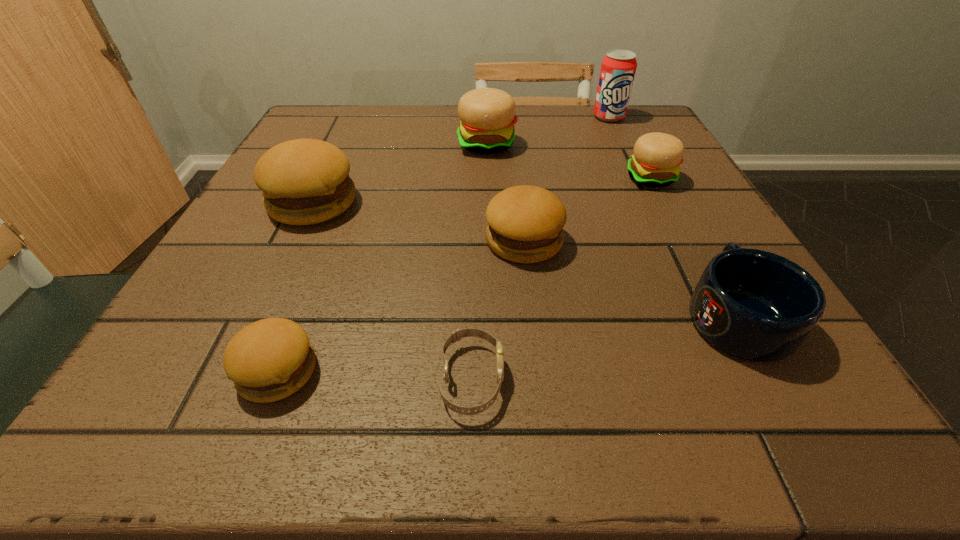
You are a GUI agent. You are given a task and a screenshot of the screen. Output one action in this format:
    pyautogui.click(x=<x>, y=<y>)
    Task: Click on the object that is the seventh closest one to the farthest object
    The height and width of the screenshot is (540, 960).
    Given the screenshot: What is the action you would take?
    pyautogui.click(x=268, y=360)

Identify which object is the sixth nearest to the nearest hamburger. Please provide its 2D coordinates. Your answer should be formatted as a tuple, i.e. [(x, y)], where the tuple contains the x and y coordinates of a point satisfying the conditions above.

[(656, 161)]

This screenshot has width=960, height=540. I want to click on hamburger that can be found as the closest to the watch, so click(x=525, y=223).

Locate which hamburger ranks in proximity to the farthest object. Please provide its 2D coordinates. Your answer should be formatted as a tuple, i.e. [(x, y)], where the tuple contains the x and y coordinates of a point satisfying the conditions above.

[(656, 161)]

Locate which brown hamburger ranks in proximity to the nearer beige hamburger. Please provide its 2D coordinates. Your answer should be formatted as a tuple, i.e. [(x, y)], where the tuple contains the x and y coordinates of a point satisfying the conditions above.

[(525, 223)]

Identify which brown hamburger is located as the second nearest to the left beige hamburger. Please provide its 2D coordinates. Your answer should be formatted as a tuple, i.e. [(x, y)], where the tuple contains the x and y coordinates of a point satisfying the conditions above.

[(525, 223)]

The width and height of the screenshot is (960, 540). Identify the location of vacant position in the image that satisfies the following two spatial constraints: 1. on the surface of the farthest object; 2. on the face of the watch. (735, 380).